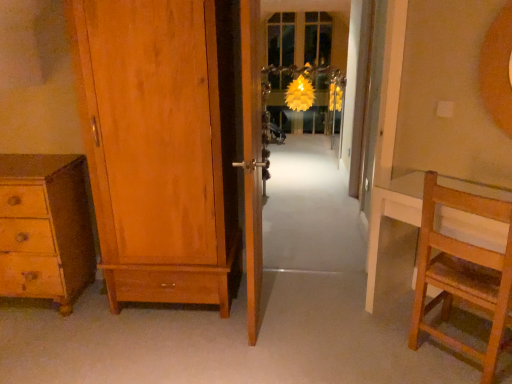
This screenshot has height=384, width=512. I want to click on free space to the left of wooden door at center, the 1th door in the right-to-left sequence, so click(176, 334).